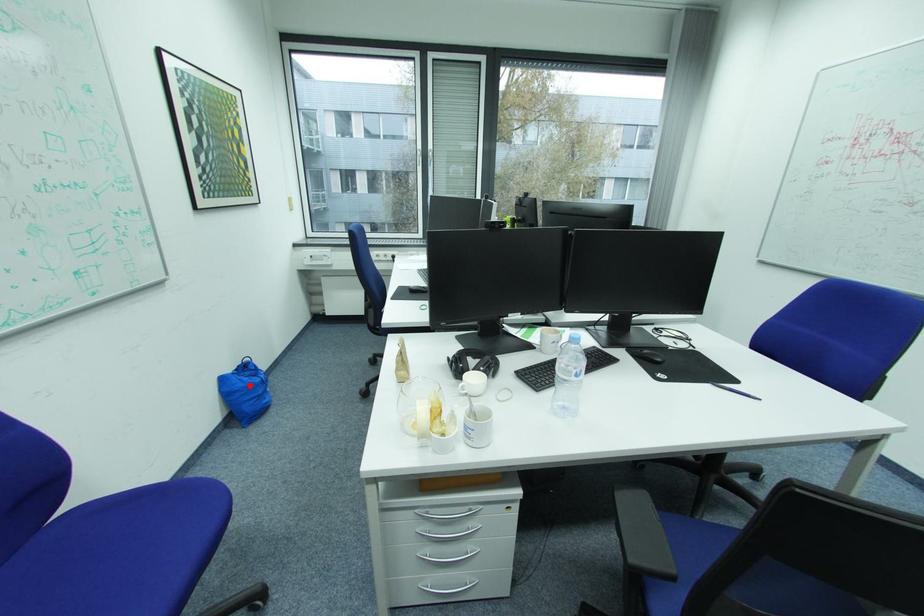
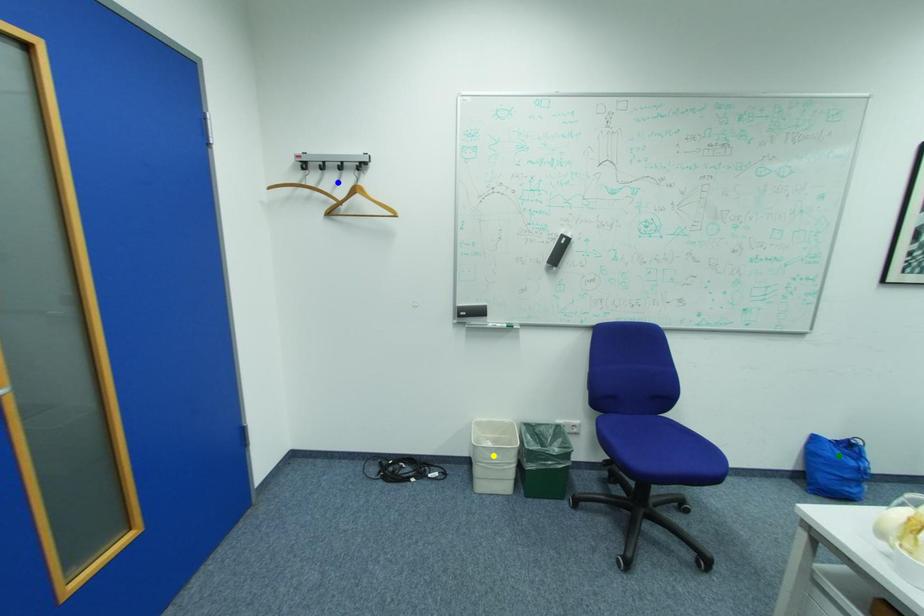
Question: I am providing you with two images of the same scene from different viewpoints. A red point is marked on the first image. You are given multiple points on the second image. Can you choose the point in image 2 that corresponds to the point in image 1?

Choices:
 (A) yellow point
 (B) blue point
 (C) green point

Answer: (C)